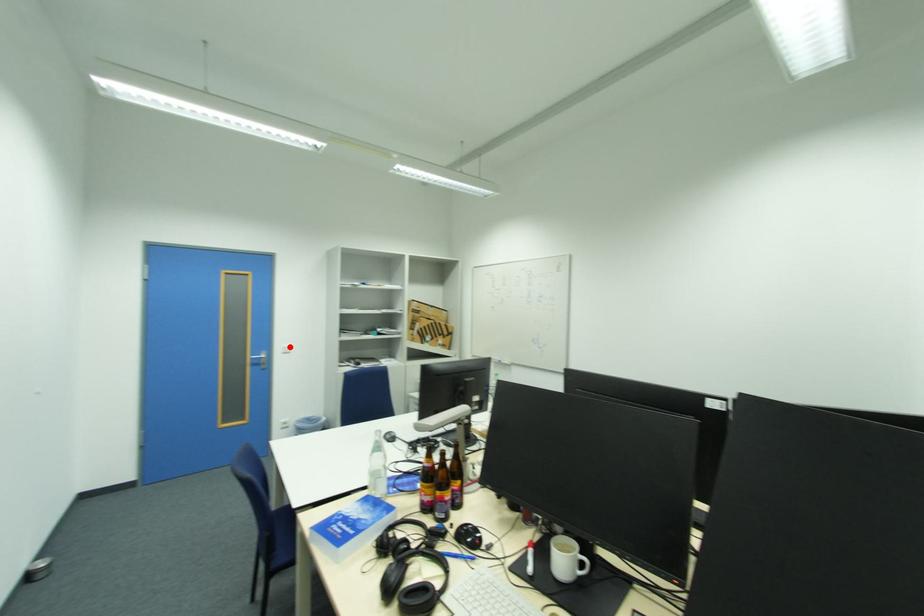
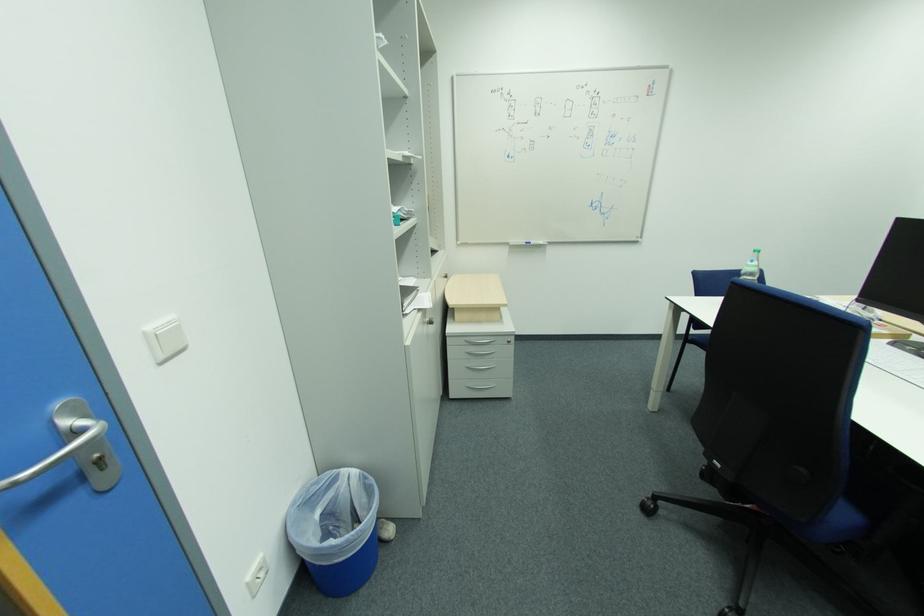
Find the pixel in the second image that matches the highlighted location in the first image.

(154, 329)